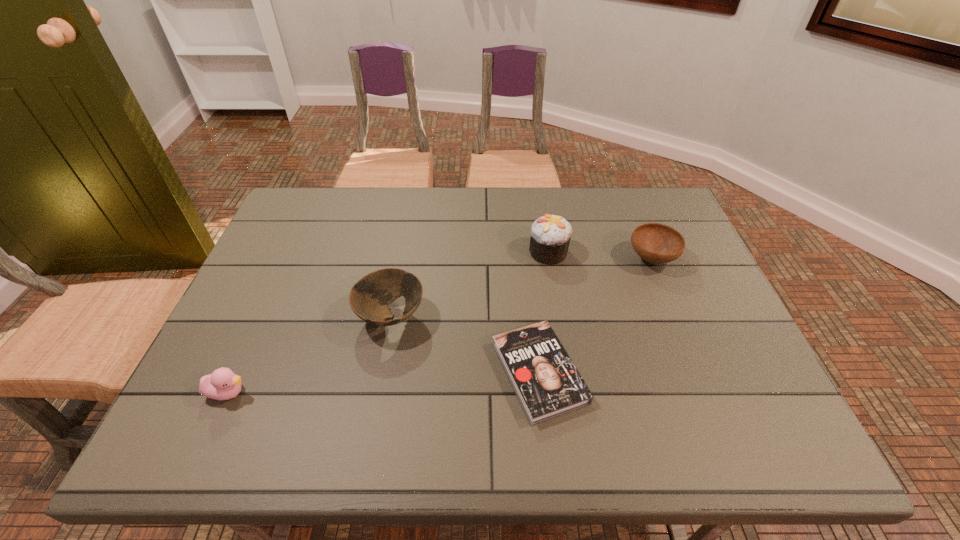
Identify the location of object that is the third nearest to the fourth object from right to left. This screenshot has width=960, height=540. (550, 235).

You are a GUI agent. You are given a task and a screenshot of the screen. Output one action in this format:
    pyautogui.click(x=<x>, y=<y>)
    Task: Click on the free space that satisfies the following two spatial constraints: 1. on the front side of the left bowl; 2. on the front-facing side of the duckling
    Image resolution: width=960 pixels, height=540 pixels.
    Given the screenshot: What is the action you would take?
    [377, 392]

Locate an element on the screen. free space that satisfies the following two spatial constraints: 1. on the front side of the shorter bowl; 2. on the front-facing side of the leftmost object is located at coordinates (706, 392).

At what (x,y) coordinates should I click in order to perform the action: click on vacant space that satisfies the following two spatial constraints: 1. on the front side of the nearer bowl; 2. on the front-facing side of the leftmost object. Please return your answer as a coordinate pair (x, y). Looking at the image, I should click on [377, 392].